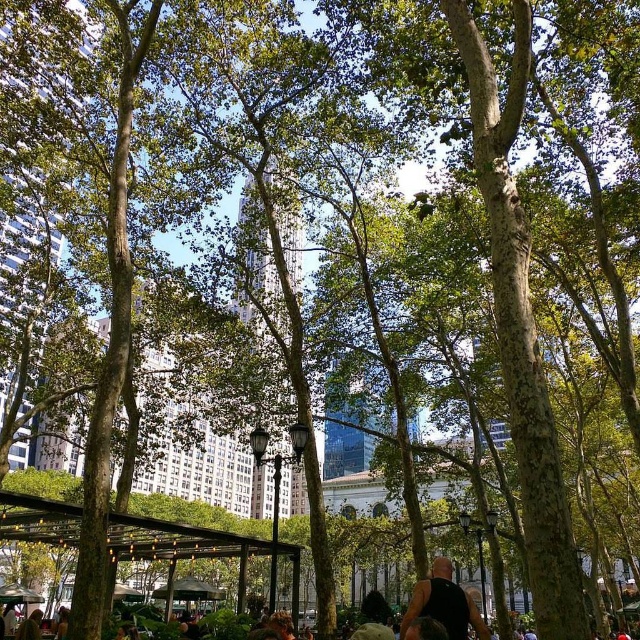
Does brown wooden canopy at center appear on the right side of metallic silver canopy at lower left?

Indeed, brown wooden canopy at center is positioned on the right side of metallic silver canopy at lower left.

Who is positioned more to the right, brown wooden canopy at center or metallic silver canopy at lower left?

Positioned to the right is brown wooden canopy at center.

Between point (180, 595) and point (26, 589), which one is positioned behind?

Positioned behind is point (180, 595).

Find the location of a particular element. This screenshot has width=640, height=640. brown wooden canopy at center is located at coordinates (195, 589).

Does black sleeveless shirt at center appear on the right side of brown wooden canopy at center?

Correct, you'll find black sleeveless shirt at center to the right of brown wooden canopy at center.

This screenshot has height=640, width=640. I want to click on black sleeveless shirt at center, so click(444, 604).

Which is below, black sleeveless shirt at center or metallic silver canopy at lower left?

metallic silver canopy at lower left

Can you confirm if black sleeveless shirt at center is taller than metallic silver canopy at lower left?

Correct, black sleeveless shirt at center is much taller as metallic silver canopy at lower left.

Between point (442, 604) and point (8, 588), which one is positioned in front?

Point (442, 604)

Where is `black sleeveless shirt at center`? black sleeveless shirt at center is located at coordinates (444, 604).